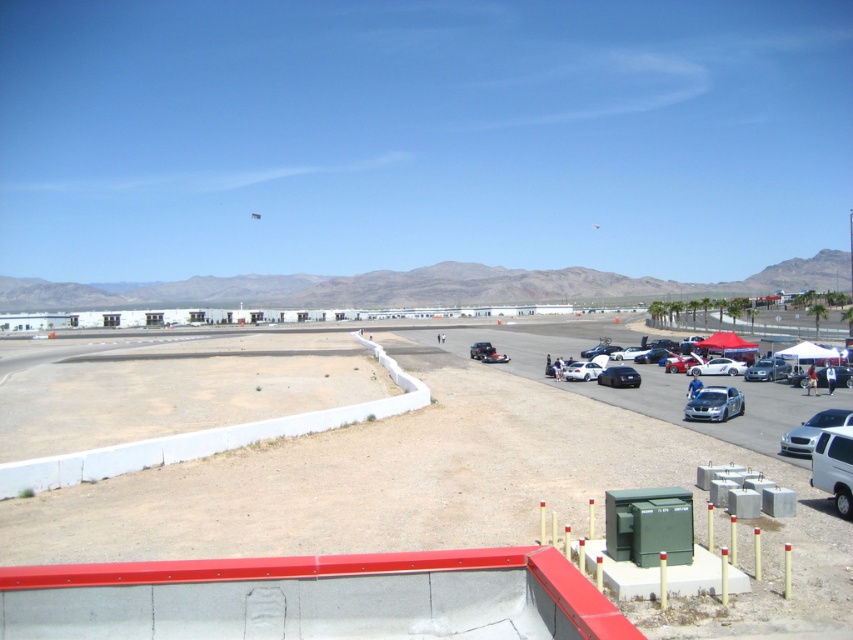
You are a photographer trying to capture both the shiny silver sedan at lower right and the shiny silver car at center right in a single frame. Which car should you position closer to the camera to ensure both are fully visible without cropping?

To ensure both the shiny silver sedan at lower right and the shiny silver car at center right are fully visible in a single frame, you should position the shiny silver sedan at lower right closer to the camera. Since it is shorter than the shiny silver car at center right, placing it nearer will help maintain their proportions and prevent cropping.

You are a delivery driver who needs to park your truck between the shiny black car at lower right and the shiny silver car at center right. Can your truck fit in the space between them?

The shiny black car at lower right is bigger than the shiny silver car at center right, but the exact distance between them isn not provided. Without knowing the space between them, it is impossible to determine if the truck can fit.

You are standing at the center of the dirt area and want to park your car in the parking spot near the white concrete curb. There are two cars in the way, the satin silver car at lower right and the white glossy sedan at lower right. Which car is closer to the curb so you can decide which one to move first?

The satin silver car at lower right is to the right of the white glossy sedan at lower right. Since both are at the lower right, the white glossy sedan is closer to the curb, so you should move it first to access the parking spot.